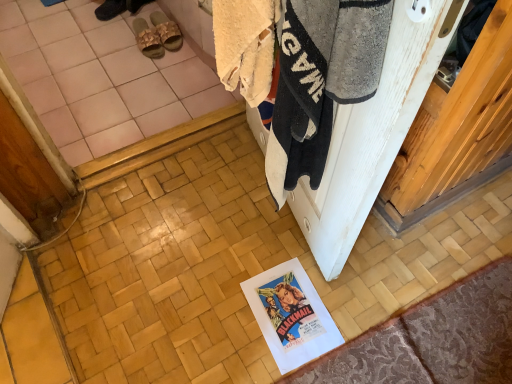
The image size is (512, 384). What are the coordinates of `vacant area located to the right-hand side of white paper at lower center` in the screenshot? It's located at (356, 308).